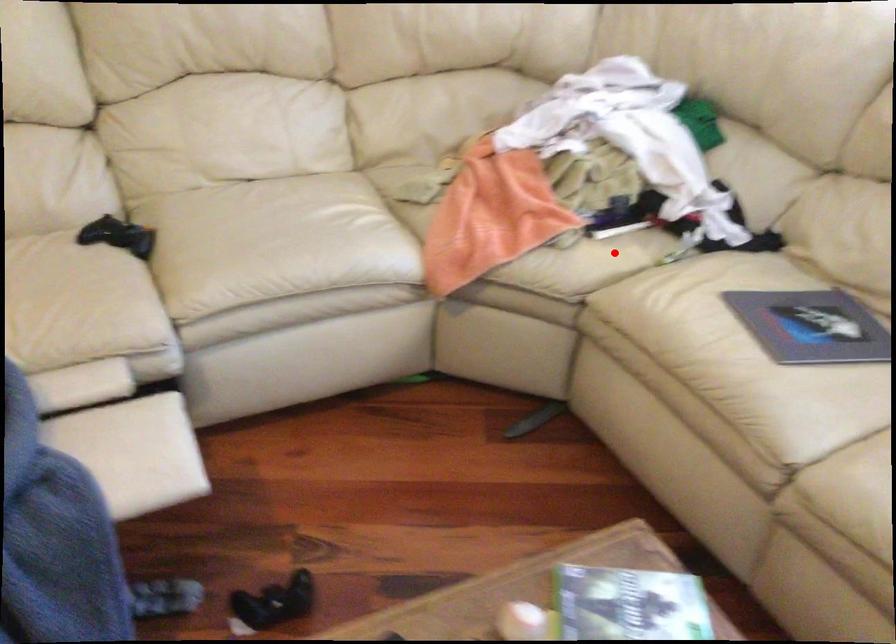
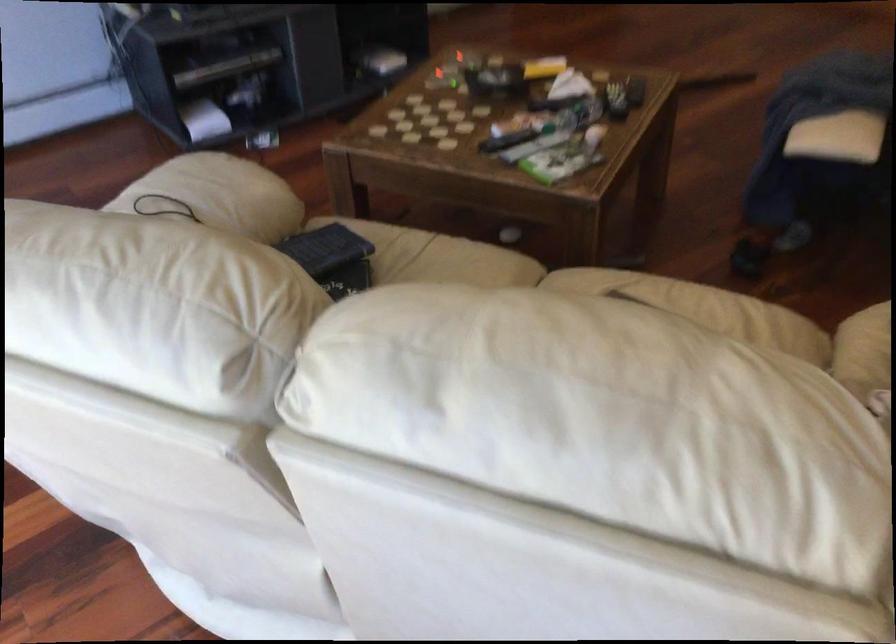
Question: I am providing you with two images of the same scene from different viewpoints. A red point is shown in image1. For the corresponding object point in image2, is it positioned nearer or farther from the camera?

Choices:
 (A) Nearer
 (B) Farther

Answer: (A)